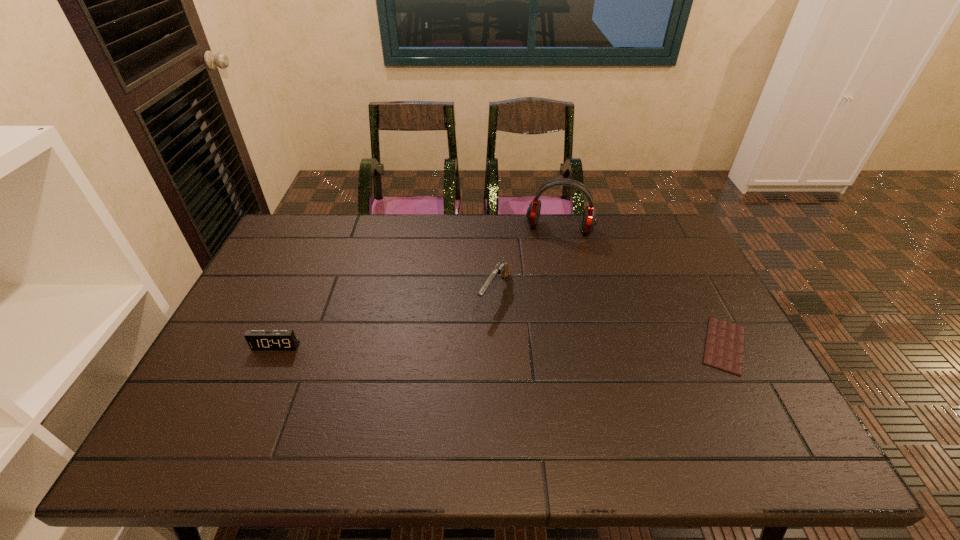
Locate an element on the screen. The image size is (960, 540). vacant space at the left edge of the desktop is located at coordinates (283, 329).

The image size is (960, 540). In the image, there is a desktop. What are the coordinates of `free space at the right edge` in the screenshot? It's located at (683, 293).

The image size is (960, 540). Identify the location of unoccupied area between the second farthest object and the rightmost object. (610, 319).

The height and width of the screenshot is (540, 960). I want to click on free space between the tallest object and the alarm clock, so click(418, 287).

Where is `free space between the rightmost object and the third object from left to right`? This screenshot has height=540, width=960. free space between the rightmost object and the third object from left to right is located at coordinates (642, 287).

In order to click on vacant area that lies between the earphone and the third object from right to left in this screenshot , I will do `click(527, 261)`.

Locate an element on the screen. empty location between the third object from right to left and the leftmost object is located at coordinates (x=385, y=319).

Find the location of a particular element. This screenshot has width=960, height=540. unoccupied position between the rightmost object and the third object from left to right is located at coordinates (642, 287).

Identify the location of vacant region between the alarm clock and the second object from right to left. (418, 287).

The image size is (960, 540). I want to click on free point between the third nearest object and the chocolate bar, so click(610, 319).